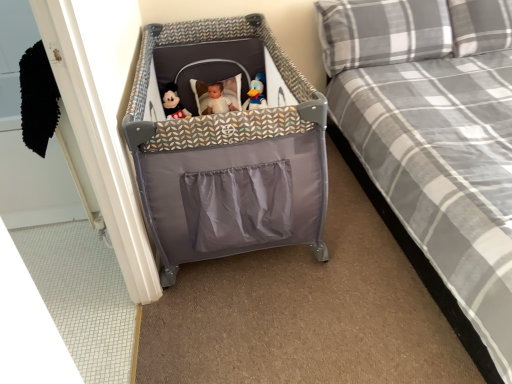
Question: Is matte plush mickey mouse at center in front of or behind blue plush duck at center in the image?

Choices:
 (A) front
 (B) behind

Answer: (B)

Question: Based on their sizes in the image, would you say matte plush mickey mouse at center is bigger or smaller than blue plush duck at center?

Choices:
 (A) small
 (B) big

Answer: (B)

Question: Considering the real-world distances, which object is closest to the blue plush duck at center?

Choices:
 (A) gray plaid pillow at upper right, which is the second pillow in right-to-left order
 (B) gray plaid pillow at upper right, the first pillow from the right
 (C) plaid fabric bed at center
 (D) matte plush mickey mouse at center

Answer: (D)

Question: Which of these objects is positioned closest to the gray plaid pillow at upper right, the first pillow from the right?

Choices:
 (A) blue plush duck at center
 (B) matte plush mickey mouse at center
 (C) plaid fabric bed at center
 (D) gray plaid pillow at upper right, marked as the first pillow in a left-to-right arrangement

Answer: (D)